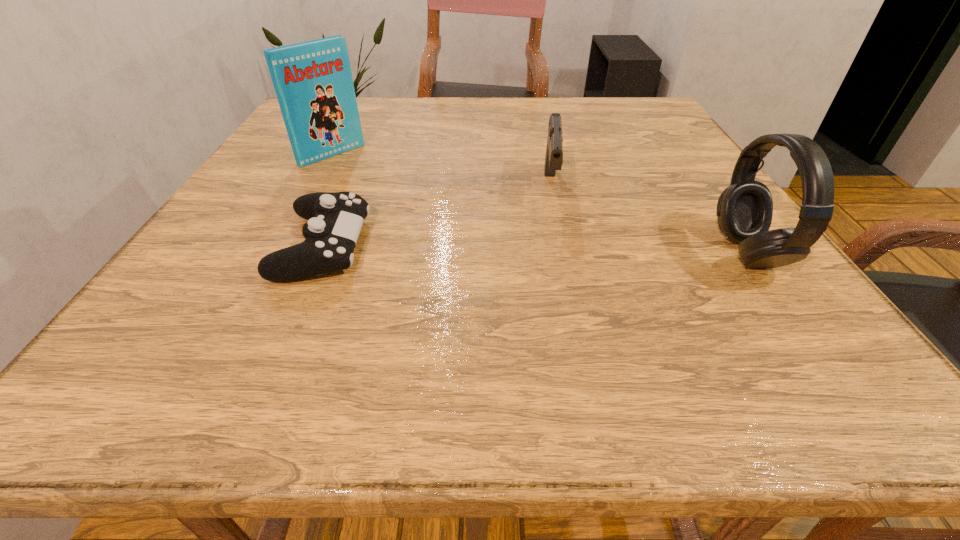
The height and width of the screenshot is (540, 960). I want to click on vacant point located between the book and the third object from left to right, so click(441, 171).

Find the location of a particular element. Image resolution: width=960 pixels, height=540 pixels. vacant area that lies between the control and the third shortest object is located at coordinates (535, 249).

Locate an element on the screen. This screenshot has height=540, width=960. vacant area that lies between the headset and the third tallest object is located at coordinates (648, 220).

The width and height of the screenshot is (960, 540). What are the coordinates of `empty space that is in between the book and the rightmost object` in the screenshot? It's located at (539, 204).

This screenshot has height=540, width=960. In order to click on free spot between the shortest object and the second tallest object in this screenshot , I will do `click(535, 249)`.

Identify which object is the closest to the third object from left to right. Please provide its 2D coordinates. Your answer should be formatted as a tuple, i.e. [(x, y)], where the tuple contains the x and y coordinates of a point satisfying the conditions above.

[(744, 212)]

You are a GUI agent. You are given a task and a screenshot of the screen. Output one action in this format:
    pyautogui.click(x=<x>, y=<y>)
    Task: Click on the object that stands as the third closest to the control
    
    Given the screenshot: What is the action you would take?
    pyautogui.click(x=744, y=212)

Where is `free location that satisfies the following two spatial constraints: 1. on the front side of the second object from right to left; 2. on the left side of the book`? The height and width of the screenshot is (540, 960). free location that satisfies the following two spatial constraints: 1. on the front side of the second object from right to left; 2. on the left side of the book is located at coordinates (315, 187).

The height and width of the screenshot is (540, 960). I want to click on free space that satisfies the following two spatial constraints: 1. on the front side of the third tallest object; 2. on the right side of the book, so click(x=315, y=187).